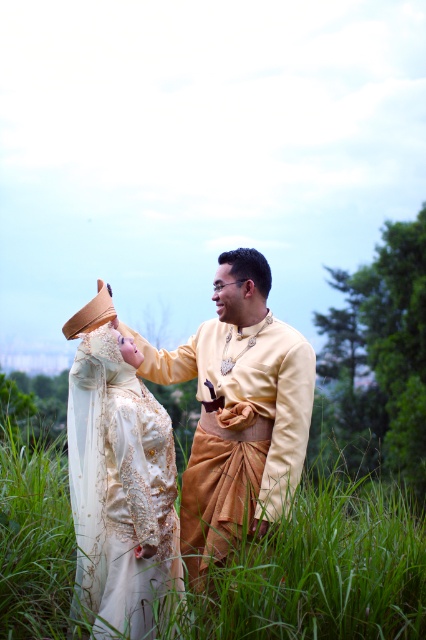
Does matte gold fabric at center have a lesser height compared to matte gold dress at center?

In fact, matte gold fabric at center may be taller than matte gold dress at center.

Between matte gold fabric at center and matte gold dress at center, which one has more height?

Standing taller between the two is matte gold fabric at center.

Which is in front, point (210, 413) or point (176, 541)?

Point (176, 541) is in front.

Image resolution: width=426 pixels, height=640 pixels. I want to click on matte gold fabric at center, so click(238, 412).

Which is above, green grass at center or matte gold dress at center?

matte gold dress at center

Between green grass at center and matte gold dress at center, which one appears on the left side from the viewer's perspective?

matte gold dress at center

Find the location of a particular element. Image resolution: width=426 pixels, height=640 pixels. green grass at center is located at coordinates (319, 573).

Locate an element on the screen. The image size is (426, 640). green grass at center is located at coordinates click(x=319, y=573).

Is green grass at center taller than matte gold fabric at center?

No, green grass at center is not taller than matte gold fabric at center.

Which of these two, green grass at center or matte gold fabric at center, stands taller?

With more height is matte gold fabric at center.

At what (x,y) coordinates should I click in order to perform the action: click on green grass at center. Please return your answer as a coordinate pair (x, y). This screenshot has height=640, width=426. Looking at the image, I should click on pos(319,573).